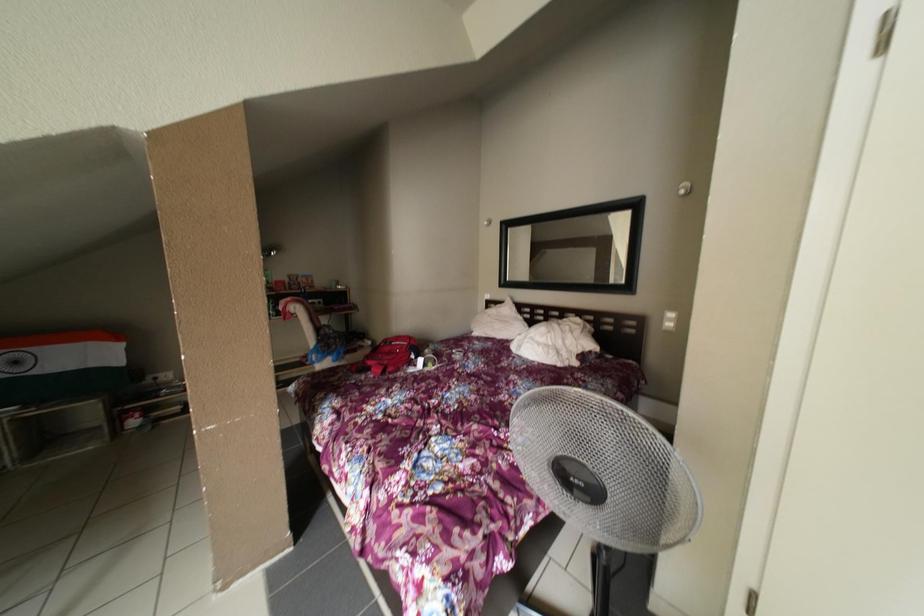
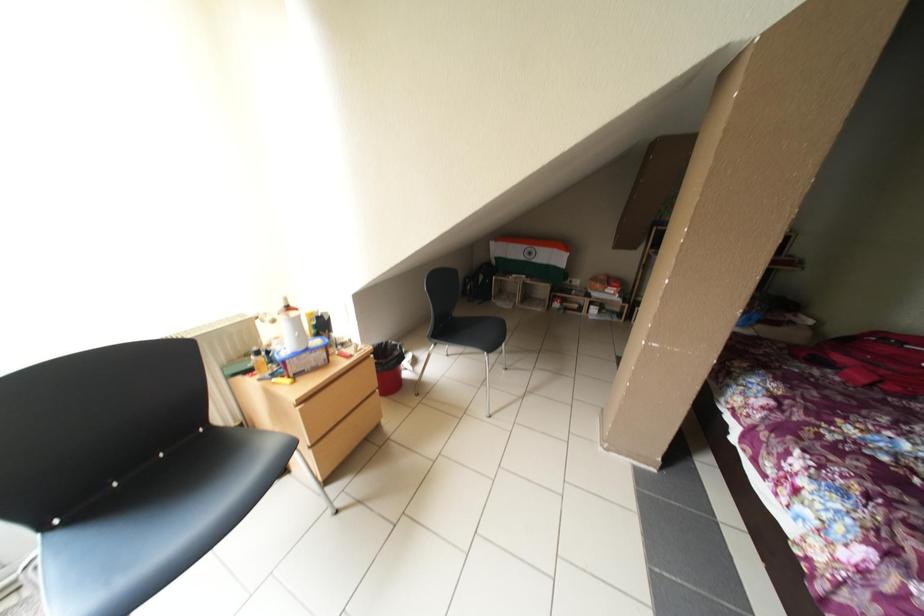
How did the camera likely rotate?

The camera rotated toward left-down.